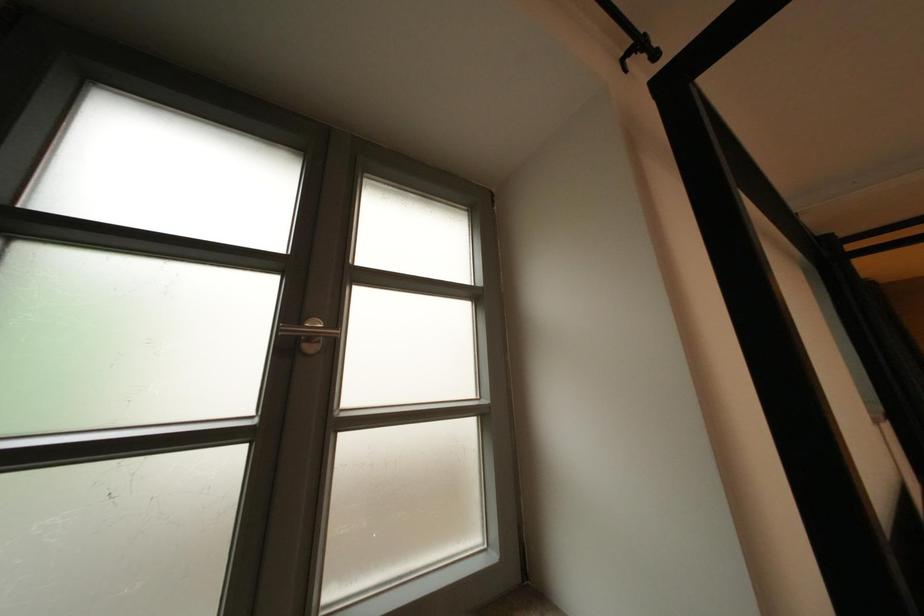
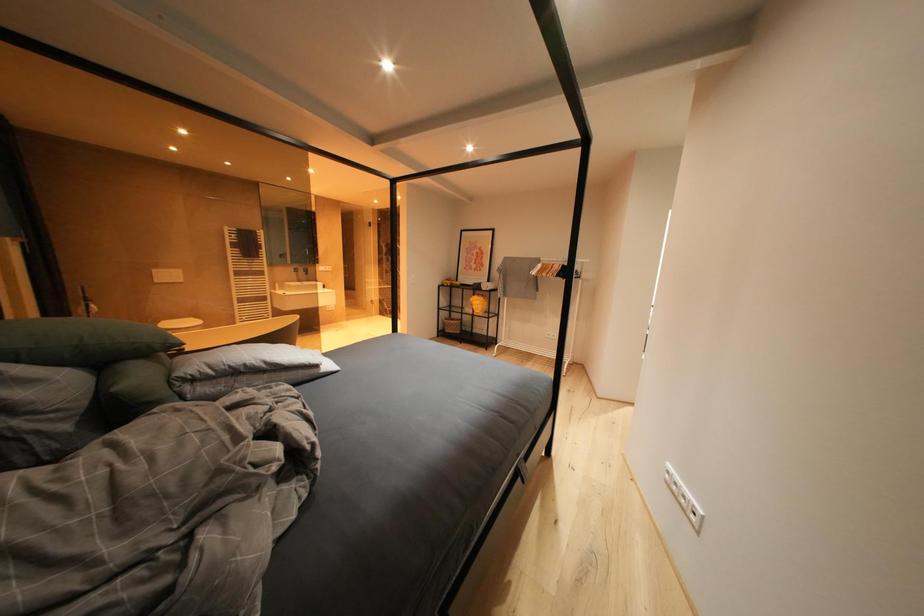
Question: The camera is either moving clockwise (left) or counter-clockwise (right) around the object. The first image is from the beginning of the video and the second image is from the end. Is the camera moving left or right when shooting the video?

Choices:
 (A) Left
 (B) Right

Answer: (A)